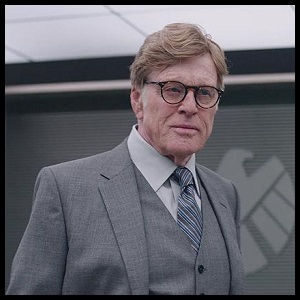
Locate an element on the screen. light gray logo on a background wall is located at coordinates (250, 197), (267, 223), (248, 246).